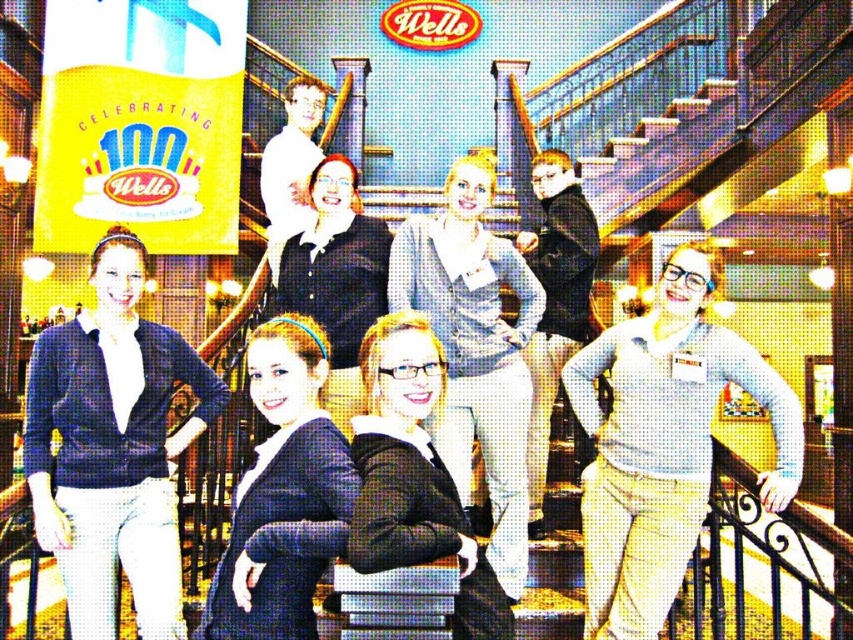
In the scene shown: You are standing at the camera position and want to walk to point (279, 493). Is the distance more than 60 feet?

Yes, the distance between the camera and point (279, 493) is 64.63 feet, which is more than 60 feet.